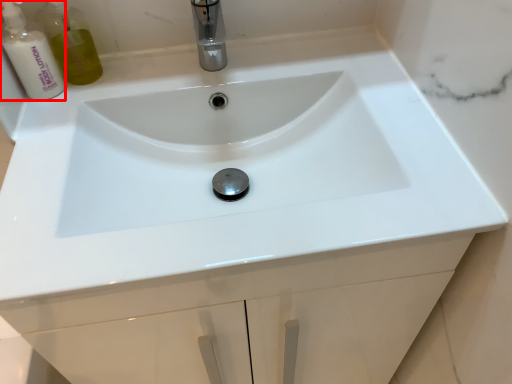
Question: Considering the relative positions of cleaning product (annotated by the red box) and tap in the image provided, where is cleaning product (annotated by the red box) located with respect to the staircase?

Choices:
 (A) left
 (B) right

Answer: (A)